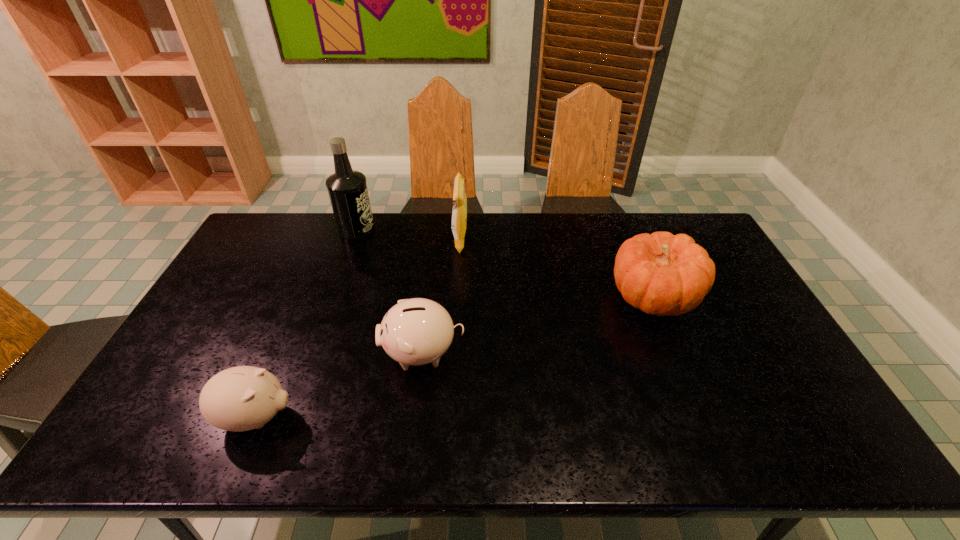
Find the location of a particular element. This screenshot has width=960, height=540. the tallest object is located at coordinates (347, 188).

Find the location of `the fourth shortest object`. the fourth shortest object is located at coordinates (459, 213).

Where is `the rightmost object`? the rightmost object is located at coordinates [x=662, y=274].

Find the location of `the farther piggy bank`. the farther piggy bank is located at coordinates (417, 331).

In order to click on the nearer piggy bank in this screenshot , I will do `click(242, 398)`.

Identify the location of the nearest object. (242, 398).

Where is `vacant space situated 0.110m on the front label of the liquor`? vacant space situated 0.110m on the front label of the liquor is located at coordinates (405, 230).

The image size is (960, 540). I want to click on free spot located on the front of the crisp (potato chip) with the logo, so click(506, 241).

This screenshot has height=540, width=960. I want to click on vacant region located on the back of the rightmost object, so click(621, 220).

This screenshot has height=540, width=960. I want to click on vacant region located 0.250m on the back of the farther piggy bank, so click(433, 271).